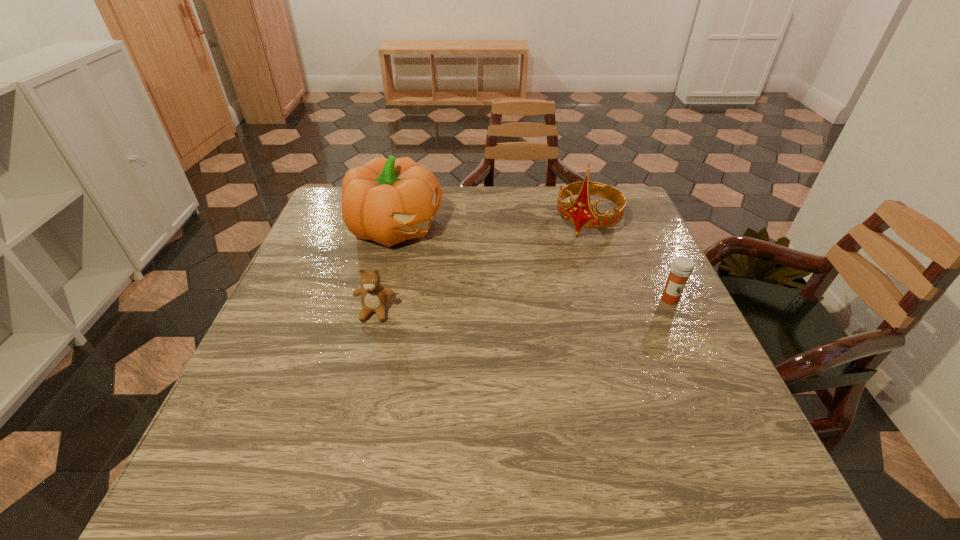
This screenshot has width=960, height=540. What are the coordinates of `free space located 0.140m on the front-facing side of the third object from left to right` in the screenshot? It's located at (557, 269).

This screenshot has height=540, width=960. I want to click on vacant space located on the front-facing side of the third object from left to right, so click(531, 308).

At what (x,y) coordinates should I click in order to perform the action: click on pumpkin that is at the far edge. Please return your answer as a coordinate pair (x, y). The height and width of the screenshot is (540, 960). Looking at the image, I should click on (391, 200).

In order to click on tiara that is at the far edge in this screenshot , I will do `click(580, 213)`.

This screenshot has height=540, width=960. Find the location of `object at the left edge`. object at the left edge is located at coordinates (391, 200).

In order to click on medicine located in the right edge section of the desktop in this screenshot , I will do `click(681, 268)`.

Image resolution: width=960 pixels, height=540 pixels. I want to click on tiara located in the right edge section of the desktop, so pos(580,213).

Identify the location of object at the far left corner. (391, 200).

This screenshot has width=960, height=540. Identify the location of object positioned at the far right corner. (580, 213).

In the image, there is a desktop. At what (x,y) coordinates should I click in order to perform the action: click on vacant space at the far edge. Please return your answer as a coordinate pair (x, y). Image resolution: width=960 pixels, height=540 pixels. Looking at the image, I should click on (533, 211).